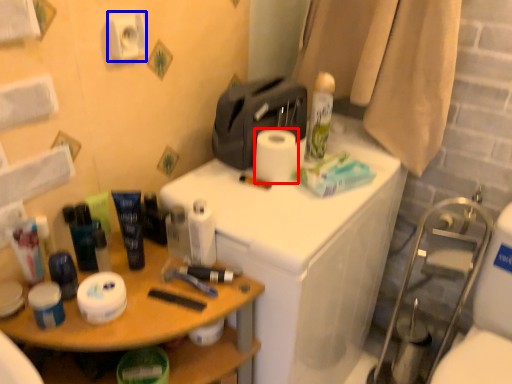
Question: Which object appears closest to the camera in this image, toilet paper (highlighted by a red box) or toilet paper (highlighted by a blue box)?

Choices:
 (A) toilet paper
 (B) toilet paper

Answer: (B)